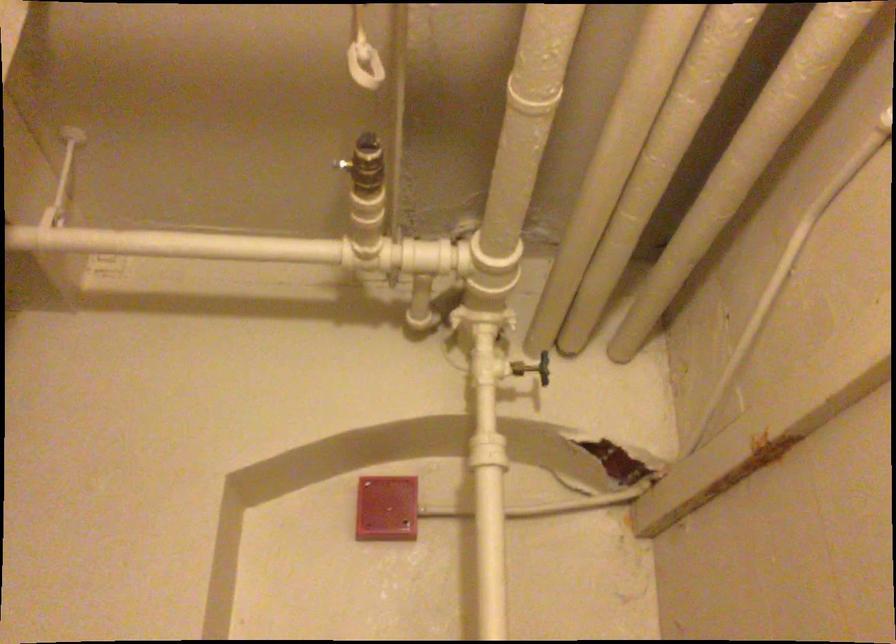
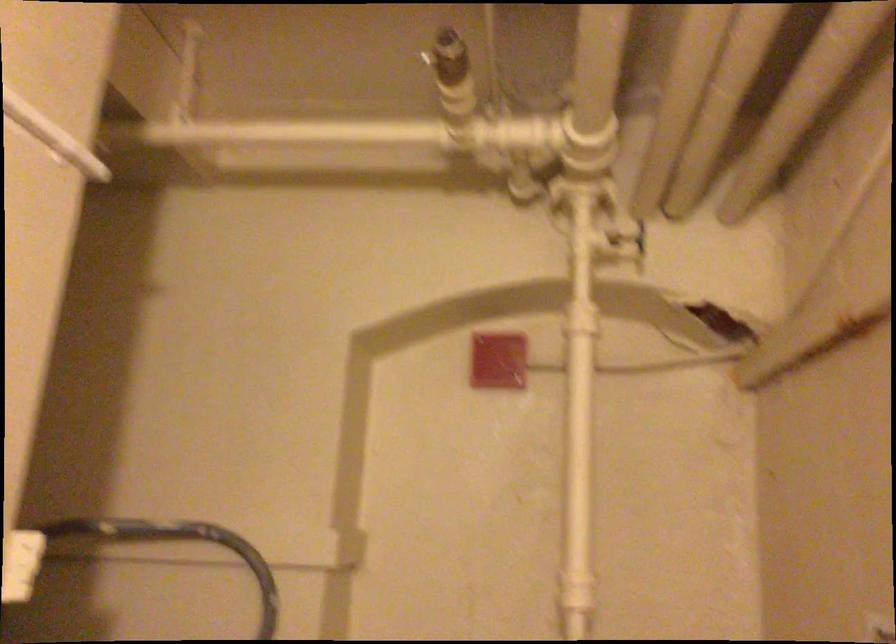
Question: Based on the continuous images, in which direction is the camera rotating? Reply with the corresponding letter.

Choices:
 (A) Left
 (B) Right
 (C) Up
 (D) Down

Answer: (D)